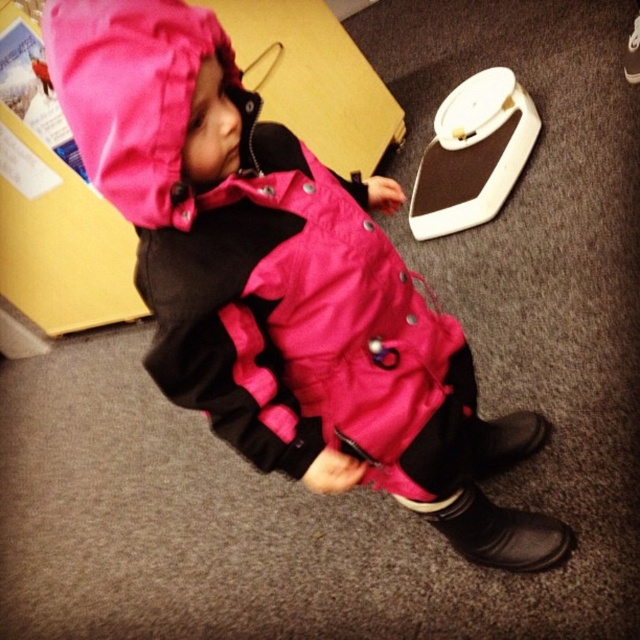
What do you see at coordinates (280, 282) in the screenshot?
I see `matte pink snowsuit at center` at bounding box center [280, 282].

Is matte pink snowsuit at center closer to camera compared to white matte scale at upper center?

Yes.

Is point (442, 499) closer to camera compared to point (497, 120)?

Yes, it is in front of point (497, 120).

The image size is (640, 640). What are the coordinates of `matte pink snowsuit at center` in the screenshot? It's located at (280, 282).

Which is above, matte pink snowsuit at center or black leather boot at lower right?

matte pink snowsuit at center is higher up.

Can you confirm if matte pink snowsuit at center is smaller than black leather boot at lower right?

Actually, matte pink snowsuit at center might be larger than black leather boot at lower right.

What are the coordinates of `matte pink snowsuit at center` in the screenshot? It's located at (280, 282).

This screenshot has height=640, width=640. Describe the element at coordinates (472, 154) in the screenshot. I see `white matte scale at upper center` at that location.

Between point (525, 128) and point (456, 513), which one is positioned in front?

Point (456, 513) is in front.

Between point (460, 115) and point (522, 547), which one is positioned in front?

Point (522, 547)

You are a GUI agent. You are given a task and a screenshot of the screen. Output one action in this format:
    pyautogui.click(x=<x>, y=<y>)
    Task: Click on the white matte scale at upper center
    
    Given the screenshot: What is the action you would take?
    pyautogui.click(x=472, y=154)